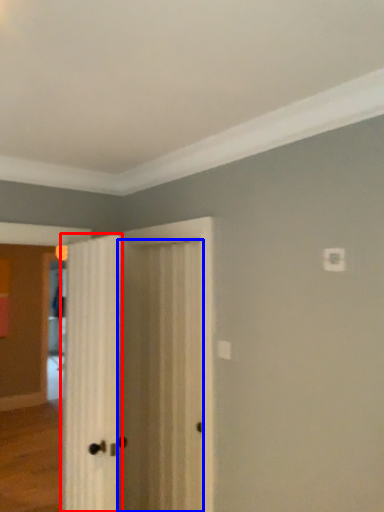
Question: Which object is closer to the camera taking this photo, door (highlighted by a red box) or door (highlighted by a blue box)?

Choices:
 (A) door
 (B) door

Answer: (A)